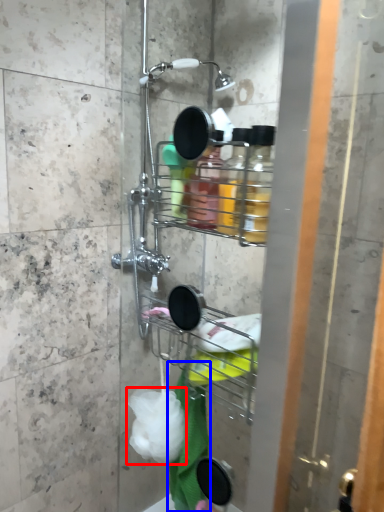
Question: Among these objects, which one is farthest to the camera, plastic (highlighted by a red box) or bath towel (highlighted by a blue box)?

Choices:
 (A) plastic
 (B) bath towel

Answer: (B)